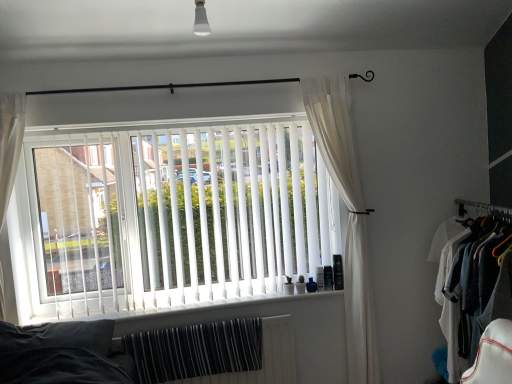
Question: From the image's perspective, is white vertical blinds at center on white cotton shirt at right?

Choices:
 (A) no
 (B) yes

Answer: (B)

Question: Is white vertical blinds at center not within white cotton shirt at right?

Choices:
 (A) no
 (B) yes

Answer: (B)

Question: Is white vertical blinds at center next to white cotton shirt at right and touching it?

Choices:
 (A) yes
 (B) no

Answer: (B)

Question: Are white vertical blinds at center and white cotton shirt at right located far from each other?

Choices:
 (A) no
 (B) yes

Answer: (B)

Question: Can you confirm if white vertical blinds at center is bigger than white cotton shirt at right?

Choices:
 (A) yes
 (B) no

Answer: (B)

Question: From the image's perspective, would you say white vertical blinds at center is shown under white cotton shirt at right?

Choices:
 (A) yes
 (B) no

Answer: (B)

Question: Is white sheer curtain at right not close to black metal rod at upper center?

Choices:
 (A) yes
 (B) no

Answer: (B)

Question: Is white sheer curtain at right smaller than black metal rod at upper center?

Choices:
 (A) no
 (B) yes

Answer: (A)

Question: From a real-world perspective, is white sheer curtain at right positioned over black metal rod at upper center based on gravity?

Choices:
 (A) no
 (B) yes

Answer: (A)

Question: Does white sheer curtain at right come behind black metal rod at upper center?

Choices:
 (A) no
 (B) yes

Answer: (B)

Question: Can we say white sheer curtain at right lies outside black metal rod at upper center?

Choices:
 (A) no
 (B) yes

Answer: (B)

Question: Is white sheer curtain at right next to black metal rod at upper center and touching it?

Choices:
 (A) no
 (B) yes

Answer: (A)

Question: Considering the relative positions of white sheer curtain at right and white cotton shirt at right in the image provided, is white sheer curtain at right in front of white cotton shirt at right?

Choices:
 (A) yes
 (B) no

Answer: (B)